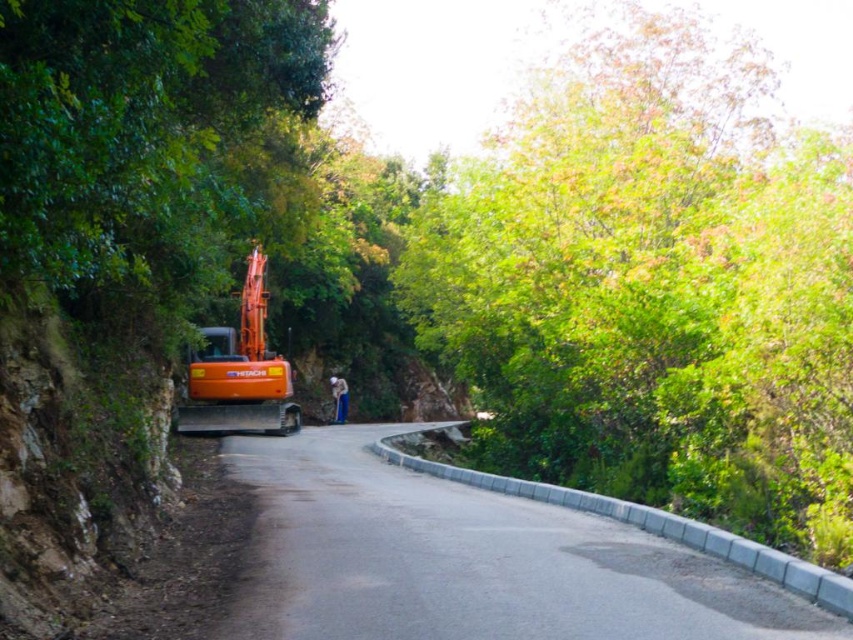
Does green leafy tree at upper center appear on the right side of asphalt road at center?

Indeed, green leafy tree at upper center is positioned on the right side of asphalt road at center.

Who is more forward, (485, 467) or (370, 458)?

Point (370, 458)

You are a GUI agent. You are given a task and a screenshot of the screen. Output one action in this format:
    pyautogui.click(x=<x>, y=<y>)
    Task: Click on the green leafy tree at upper center
    This screenshot has height=640, width=853.
    Given the screenshot: What is the action you would take?
    tap(653, 285)

At what (x,y) coordinates should I click in order to perform the action: click on green leafy tree at upper center. Please return your answer as a coordinate pair (x, y). The width and height of the screenshot is (853, 640). Looking at the image, I should click on (653, 285).

Is point (550, 152) more distant than point (196, 429)?

Yes, point (550, 152) is behind point (196, 429).

Where is `green leafy tree at upper center`? green leafy tree at upper center is located at coordinates (653, 285).

At what (x,y) coordinates should I click in order to perform the action: click on green leafy tree at upper center. Please return your answer as a coordinate pair (x, y). The width and height of the screenshot is (853, 640). Looking at the image, I should click on (653, 285).

Who is lower down, asphalt road at center or orange metallic excavator at left?

asphalt road at center

Is asphalt road at center to the right of orange metallic excavator at left from the viewer's perspective?

Correct, you'll find asphalt road at center to the right of orange metallic excavator at left.

Between point (456, 611) and point (257, 301), which one is positioned behind?

The point (257, 301) is behind.

The image size is (853, 640). I want to click on asphalt road at center, so click(468, 561).